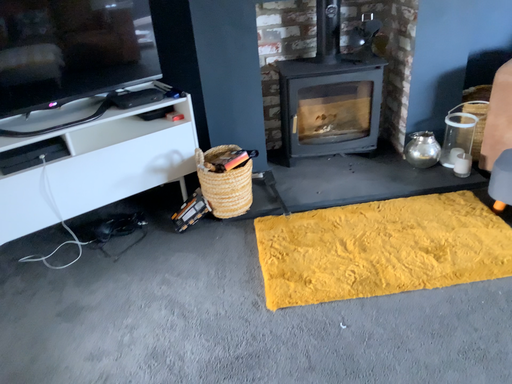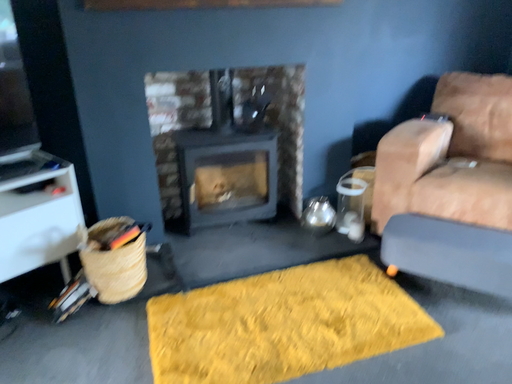
Question: How did the camera likely rotate when shooting the video?

Choices:
 (A) rotated right
 (B) rotated left

Answer: (A)